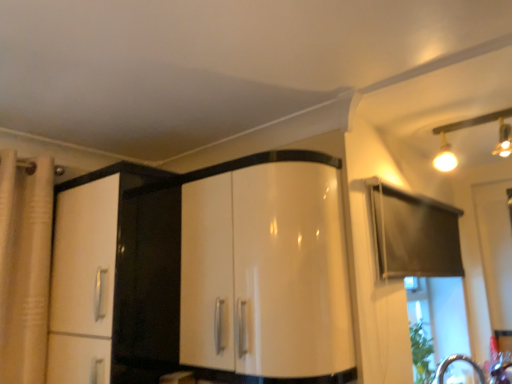
Describe the element at coordinates (471, 126) in the screenshot. I see `matte gold track lights at upper right` at that location.

This screenshot has width=512, height=384. Identify the location of matte gold track lights at upper right. (471, 126).

What is the approximate width of matte gold track lights at upper right?

The width of matte gold track lights at upper right is 18.01 inches.

Where is `glossy white cabinet at center`? This screenshot has width=512, height=384. glossy white cabinet at center is located at coordinates (203, 274).

What do you see at coordinates (203, 274) in the screenshot? The height and width of the screenshot is (384, 512). I see `glossy white cabinet at center` at bounding box center [203, 274].

Measure the distance between glossy white cabinet at center and camera.

glossy white cabinet at center is 1.36 meters away from camera.

The width and height of the screenshot is (512, 384). Identify the location of matte gold track lights at upper right. (471, 126).

Can you confirm if matte gold track lights at upper right is positioned to the left of glossy white cabinet at center?

No, matte gold track lights at upper right is not to the left of glossy white cabinet at center.

Is matte gold track lights at upper right closer to the viewer compared to glossy white cabinet at center?

No, it is not.

Is point (445, 165) positioned in front of point (270, 369)?

No, (445, 165) is further to viewer.

From the image's perspective, between matte gold track lights at upper right and glossy white cabinet at center, which one is located above?

matte gold track lights at upper right appears higher in the image.

From a real-world perspective, is matte gold track lights at upper right physically below glossy white cabinet at center?

No, from a real-world perspective, matte gold track lights at upper right is not below glossy white cabinet at center.

Considering the relative sizes of matte gold track lights at upper right and glossy white cabinet at center in the image provided, is matte gold track lights at upper right thinner than glossy white cabinet at center?

No, matte gold track lights at upper right is not thinner than glossy white cabinet at center.

Does matte gold track lights at upper right have a lesser height compared to glossy white cabinet at center?

Correct, matte gold track lights at upper right is not as tall as glossy white cabinet at center.

Considering the relative sizes of matte gold track lights at upper right and glossy white cabinet at center in the image provided, is matte gold track lights at upper right smaller than glossy white cabinet at center?

Indeed, matte gold track lights at upper right has a smaller size compared to glossy white cabinet at center.

Is matte gold track lights at upper right inside the boundaries of glossy white cabinet at center, or outside?

matte gold track lights at upper right exists outside the volume of glossy white cabinet at center.

Consider the image. Is matte gold track lights at upper right far away from glossy white cabinet at center?

Yes.

Is matte gold track lights at upper right turned away from glossy white cabinet at center?

matte gold track lights at upper right does not have its back to glossy white cabinet at center.

Can you tell me how much matte gold track lights at upper right and glossy white cabinet at center differ in facing direction?

The angle between the facing direction of matte gold track lights at upper right and the facing direction of glossy white cabinet at center is 89.1 degrees.

Locate an element on the screen. Image resolution: width=512 pixels, height=384 pixels. light fixture above the glossy white cabinet at center (from a real-world perspective) is located at coordinates (471, 126).

Is glossy white cabinet at center at the right side of matte gold track lights at upper right?

No, glossy white cabinet at center is not to the right of matte gold track lights at upper right.

In the image, is glossy white cabinet at center positioned in front of or behind matte gold track lights at upper right?

Clearly, glossy white cabinet at center is in front of matte gold track lights at upper right.

Which is closer, (138, 330) or (438, 156)?

The point (138, 330) is closer.

From the image's perspective, which one is positioned lower, glossy white cabinet at center or matte gold track lights at upper right?

glossy white cabinet at center, from the image's perspective.

From a real-world perspective, is glossy white cabinet at center physically located above or below matte gold track lights at upper right?

From a real-world perspective, glossy white cabinet at center is physically below matte gold track lights at upper right.

In the scene shown: Can you confirm if glossy white cabinet at center is wider than matte gold track lights at upper right?

No.

Is glossy white cabinet at center taller than matte gold track lights at upper right?

Indeed, glossy white cabinet at center has a greater height compared to matte gold track lights at upper right.

Which of these two, glossy white cabinet at center or matte gold track lights at upper right, is bigger?

glossy white cabinet at center.

In the scene shown: Is matte gold track lights at upper right a part of glossy white cabinet at center?

That's incorrect, matte gold track lights at upper right is not inside glossy white cabinet at center.

Is glossy white cabinet at center directly adjacent to matte gold track lights at upper right?

No, glossy white cabinet at center is not touching matte gold track lights at upper right.

Looking at this image, does glossy white cabinet at center turn towards matte gold track lights at upper right?

No, glossy white cabinet at center is not facing towards matte gold track lights at upper right.

Locate an element on the screen. The image size is (512, 384). light fixture behind the glossy white cabinet at center is located at coordinates (471, 126).

Where is `light fixture located on the right of glossy white cabinet at center`? The width and height of the screenshot is (512, 384). light fixture located on the right of glossy white cabinet at center is located at coordinates (471, 126).

Where is `cabinetry below the matte gold track lights at upper right (from the image's perspective)`? This screenshot has width=512, height=384. cabinetry below the matte gold track lights at upper right (from the image's perspective) is located at coordinates [203, 274].